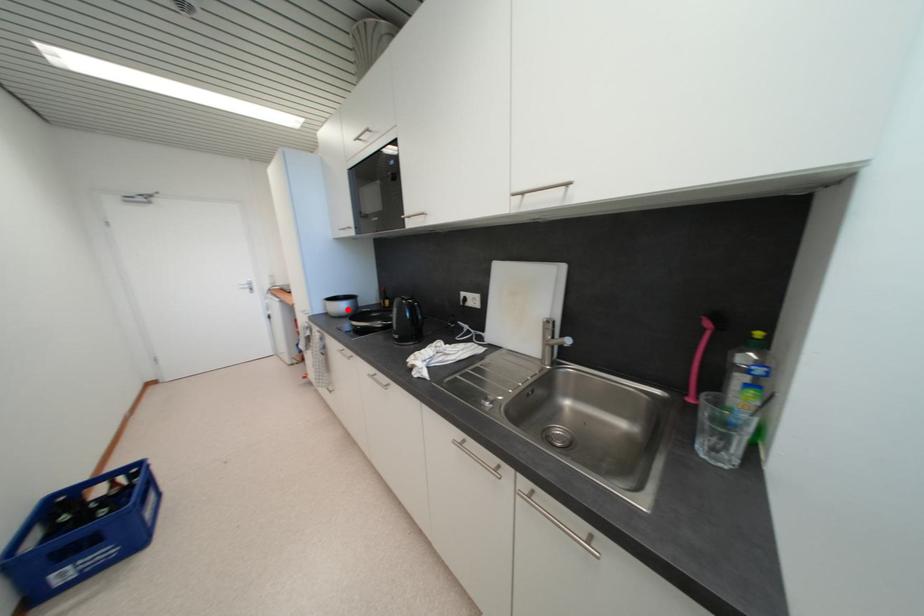
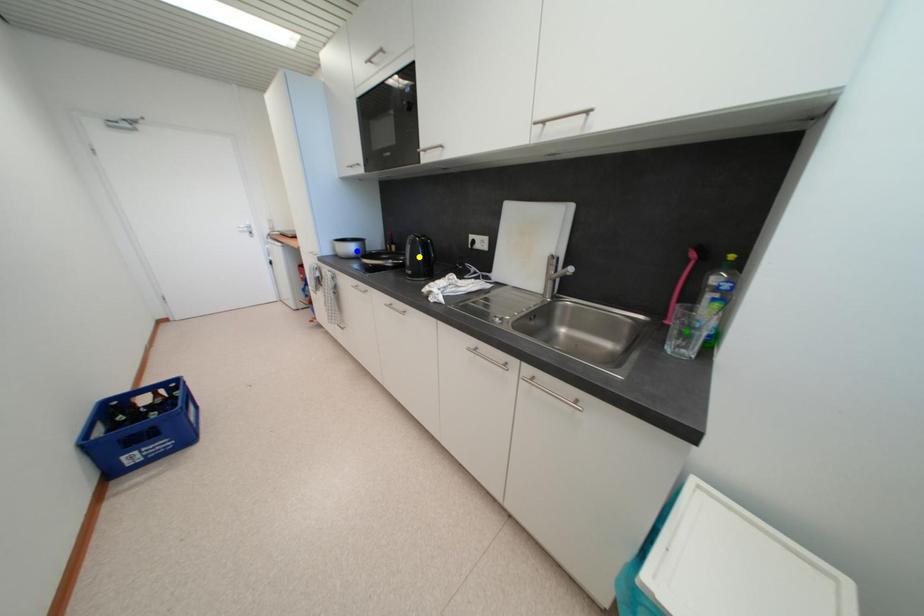
Question: I am providing you with two images of the same scene from different viewpoints. A red point is marked on the first image. You are given multiple points on the second image. Which mark in image 2 goes with the point in image 1?

Choices:
 (A) yellow point
 (B) green point
 (C) blue point

Answer: (C)